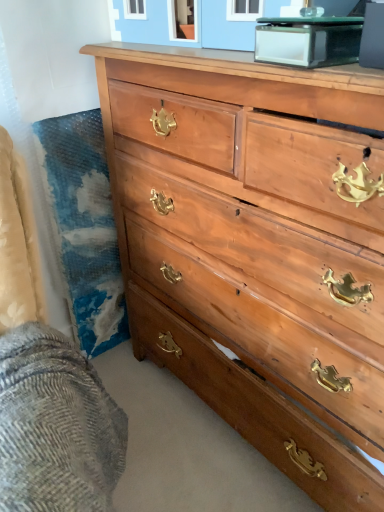
Question: Is woolen fabric at lower left bigger than light brown wood chest of drawers at center?

Choices:
 (A) no
 (B) yes

Answer: (A)

Question: Considering the relative positions of woolen fabric at lower left and light brown wood chest of drawers at center in the image provided, is woolen fabric at lower left to the right of light brown wood chest of drawers at center from the viewer's perspective?

Choices:
 (A) yes
 (B) no

Answer: (B)

Question: From a real-world perspective, is woolen fabric at lower left over light brown wood chest of drawers at center?

Choices:
 (A) yes
 (B) no

Answer: (B)

Question: From the image's perspective, would you say woolen fabric at lower left is shown under light brown wood chest of drawers at center?

Choices:
 (A) yes
 (B) no

Answer: (A)

Question: Could you tell me if woolen fabric at lower left is turned towards light brown wood chest of drawers at center?

Choices:
 (A) no
 (B) yes

Answer: (A)

Question: Can we say woolen fabric at lower left lies outside light brown wood chest of drawers at center?

Choices:
 (A) yes
 (B) no

Answer: (A)

Question: From a real-world perspective, is clear glass table at upper center physically below woolen fabric at lower left?

Choices:
 (A) no
 (B) yes

Answer: (A)

Question: From the image's perspective, is clear glass table at upper center located beneath woolen fabric at lower left?

Choices:
 (A) yes
 (B) no

Answer: (B)

Question: Could you tell me if clear glass table at upper center is facing woolen fabric at lower left?

Choices:
 (A) no
 (B) yes

Answer: (A)

Question: Are clear glass table at upper center and woolen fabric at lower left far apart?

Choices:
 (A) yes
 (B) no

Answer: (B)

Question: Is clear glass table at upper center outside woolen fabric at lower left?

Choices:
 (A) yes
 (B) no

Answer: (A)

Question: Can you see clear glass table at upper center touching woolen fabric at lower left?

Choices:
 (A) yes
 (B) no

Answer: (B)

Question: Is woolen fabric at lower left thinner than clear glass table at upper center?

Choices:
 (A) no
 (B) yes

Answer: (A)